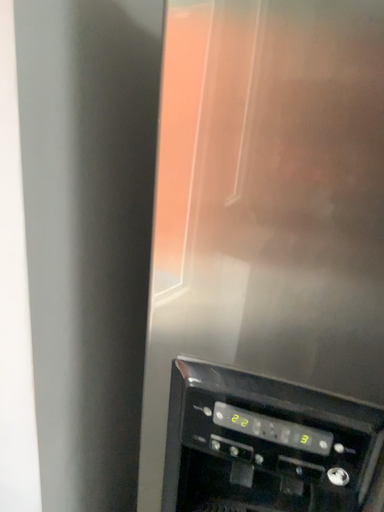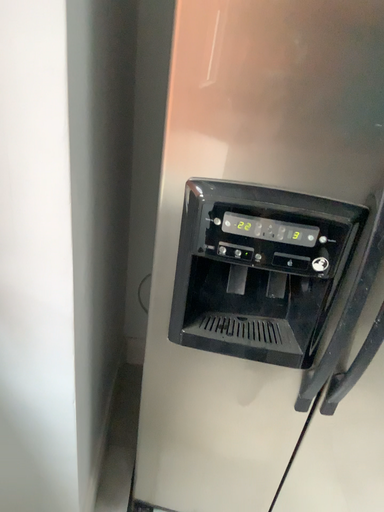
Question: How did the camera likely rotate when shooting the video?

Choices:
 (A) rotated right
 (B) rotated left

Answer: (A)